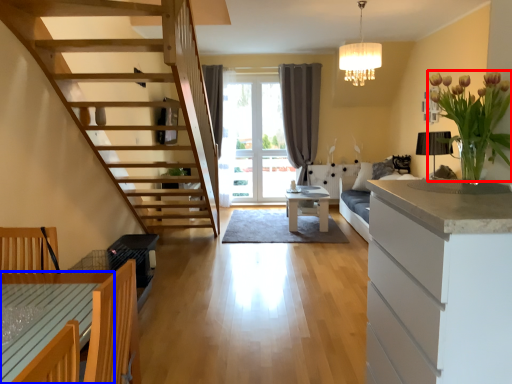
Question: Which object appears closest to the camera in this image, flower (highlighted by a red box) or table (highlighted by a blue box)?

Choices:
 (A) flower
 (B) table

Answer: (B)